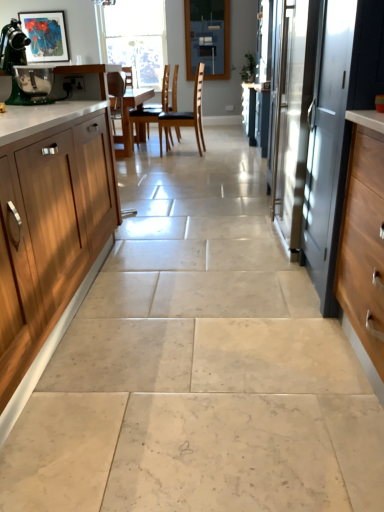
Where is `matte acrylic painting at upper left`? Image resolution: width=384 pixels, height=512 pixels. matte acrylic painting at upper left is located at coordinates (45, 36).

Identify the location of brown leather chair at center, the 2th chair positioned from the right. The image size is (384, 512). (155, 105).

The image size is (384, 512). Find the location of `satin silver screen door at right`. satin silver screen door at right is located at coordinates (328, 151).

Image resolution: width=384 pixels, height=512 pixels. Find the location of `clear glass window at upper center`. clear glass window at upper center is located at coordinates (134, 38).

This screenshot has width=384, height=512. What are the coordinates of `blue glass window screen at upper center` in the screenshot? It's located at (207, 38).

Considering the sizes of objects wooden cabinet at left and green matte coffee machine at upper left in the image provided, who is bigger, wooden cabinet at left or green matte coffee machine at upper left?

wooden cabinet at left.

From a real-world perspective, is wooden cabinet at left under green matte coffee machine at upper left?

Yes, from a real-world perspective, wooden cabinet at left is under green matte coffee machine at upper left.

Is wooden cabinet at left not close to green matte coffee machine at upper left?

Actually, wooden cabinet at left and green matte coffee machine at upper left are a little close together.

Who is taller, wooden cabinet at left or green matte coffee machine at upper left?

Standing taller between the two is wooden cabinet at left.

Measure the distance from matte acrylic painting at upper left to satin silver screen door at right.

matte acrylic painting at upper left and satin silver screen door at right are 1.55 meters apart from each other.

Which is more to the left, matte acrylic painting at upper left or satin silver screen door at right?

matte acrylic painting at upper left is more to the left.

Based on the photo, can we say matte acrylic painting at upper left lies outside satin silver screen door at right?

Yes.

Between matte acrylic painting at upper left and satin silver screen door at right, which one has larger width?

satin silver screen door at right.

Would you say clear glass window at upper center contains brown leather chair at center, the 2th chair positioned from the right?

No.

Locate an element on the screen. The image size is (384, 512). window above the brown leather chair at center, which is counted as the 1th chair, starting from the left (from the image's perspective) is located at coordinates (134, 38).

What's the angular difference between clear glass window at upper center and brown leather chair at center, which is counted as the 1th chair, starting from the left,'s facing directions?

92.1 degrees.

Which of these two, clear glass window at upper center or brown leather chair at center, the 2th chair positioned from the right, is thinner?

Thinner between the two is clear glass window at upper center.

Measure the distance from satin silver screen door at right to brown leather chair at center, which is counted as the 1th chair, starting from the left.

satin silver screen door at right and brown leather chair at center, which is counted as the 1th chair, starting from the left, are 4.13 meters apart from each other.

Considering the sizes of objects satin silver screen door at right and brown leather chair at center, which is counted as the 1th chair, starting from the left, in the image provided, who is smaller, satin silver screen door at right or brown leather chair at center, which is counted as the 1th chair, starting from the left,?

brown leather chair at center, which is counted as the 1th chair, starting from the left, is smaller.

Does point (341, 158) come closer to viewer compared to point (131, 122)?

Yes, point (341, 158) is closer to viewer.

Would you say satin silver screen door at right is a long distance from brown leather chair at center, the 2th chair positioned from the right?

Yes, satin silver screen door at right is far from brown leather chair at center, the 2th chair positioned from the right.

In the scene shown: How much distance is there between black leather chair at center, which is counted as the first chair, starting from the right, and matte acrylic painting at upper left?

black leather chair at center, which is counted as the first chair, starting from the right, is 3.35 meters away from matte acrylic painting at upper left.

From the picture: In the image, is black leather chair at center, which is counted as the first chair, starting from the right, on the left side or the right side of matte acrylic painting at upper left?

Based on their positions, black leather chair at center, which is counted as the first chair, starting from the right, is located to the right of matte acrylic painting at upper left.

What's the angular difference between black leather chair at center, placed as the 2th chair when sorted from left to right, and matte acrylic painting at upper left's facing directions?

95.9 degrees separate the facing orientations of black leather chair at center, placed as the 2th chair when sorted from left to right, and matte acrylic painting at upper left.

Is black leather chair at center, placed as the 2th chair when sorted from left to right, with matte acrylic painting at upper left?

black leather chair at center, placed as the 2th chair when sorted from left to right, is not next to matte acrylic painting at upper left, and they're not touching.

Would you say wooden cabinet at left is inside or outside satin silver screen door at right?

wooden cabinet at left is outside satin silver screen door at right.

Can you confirm if wooden cabinet at left is smaller than satin silver screen door at right?

Incorrect, wooden cabinet at left is not smaller in size than satin silver screen door at right.

Which is behind, point (63, 246) or point (317, 239)?

The point (317, 239) is farther from the camera.

Find the location of `cabinetry located on the left of satin silver screen door at right`. cabinetry located on the left of satin silver screen door at right is located at coordinates (50, 230).

Consider the image. Which point is more forward, (167, 73) or (333, 151)?

The point (333, 151) is closer to the camera.

Identify the location of screen door on the right of brown leather chair at center, the 2th chair positioned from the right. This screenshot has width=384, height=512. (328, 151).

Is brown leather chair at center, which is counted as the 1th chair, starting from the left, beside satin silver screen door at right?

There is a gap between brown leather chair at center, which is counted as the 1th chair, starting from the left, and satin silver screen door at right.

Where is `coffee machine located above the wooden cabinet at left (from the image's perspective)`? The width and height of the screenshot is (384, 512). coffee machine located above the wooden cabinet at left (from the image's perspective) is located at coordinates (17, 63).

Image resolution: width=384 pixels, height=512 pixels. In order to click on screen door on the right of matte acrylic painting at upper left in this screenshot , I will do `click(328, 151)`.

In the scene shown: From the image, which object appears to be nearer to matte acrylic painting at upper left, satin silver screen door at right or clear glass window at upper center?

Among the two, satin silver screen door at right is located nearer to matte acrylic painting at upper left.

Estimate the real-world distances between objects in this image. Which object is further from green matte coffee machine at upper left, black leather chair at center, placed as the 2th chair when sorted from left to right, or satin silver screen door at right?

Based on the image, black leather chair at center, placed as the 2th chair when sorted from left to right, appears to be further to green matte coffee machine at upper left.

Which object lies nearer to the anchor point brown leather chair at center, the 2th chair positioned from the right, wooden cabinet at left or green matte coffee machine at upper left?

green matte coffee machine at upper left is positioned closer to the anchor brown leather chair at center, the 2th chair positioned from the right.

From the image, which object appears to be nearer to wooden cabinet at left, brown leather chair at center, the 2th chair positioned from the right, or blue glass window screen at upper center?

brown leather chair at center, the 2th chair positioned from the right.

Looking at the image, which one is located further to satin silver screen door at right, black leather chair at center, which is counted as the first chair, starting from the right, or wooden cabinet at left?

black leather chair at center, which is counted as the first chair, starting from the right.

Considering their positions, is wooden cabinet at left positioned closer to satin silver screen door at right than black leather chair at center, which is counted as the first chair, starting from the right?

wooden cabinet at left.

Looking at the image, which one is located further to blue glass window screen at upper center, wooden cabinet at left or brown leather chair at center, which is counted as the 1th chair, starting from the left?

wooden cabinet at left lies further to blue glass window screen at upper center than the other object.

When comparing their distances from satin silver screen door at right, does brown leather chair at center, which is counted as the 1th chair, starting from the left, or matte acrylic painting at upper left seem closer?

The object closer to satin silver screen door at right is matte acrylic painting at upper left.

Locate an element on the screen. Image resolution: width=384 pixels, height=512 pixels. chair between black leather chair at center, which is counted as the first chair, starting from the right, and clear glass window at upper center in the front-back direction is located at coordinates (155, 105).

At what (x,y) coordinates should I click in order to perform the action: click on coffee machine between satin silver screen door at right and clear glass window at upper center from front to back. Please return your answer as a coordinate pair (x, y). Looking at the image, I should click on (17, 63).

Find the location of `picture frame between wooden cabinet at left and clear glass window at upper center from front to back`. picture frame between wooden cabinet at left and clear glass window at upper center from front to back is located at coordinates (45, 36).

At what (x,y) coordinates should I click in order to perform the action: click on window screen between green matte coffee machine at upper left and matte acrylic painting at upper left in the front-back direction. Please return your answer as a coordinate pair (x, y). Looking at the image, I should click on (207, 38).